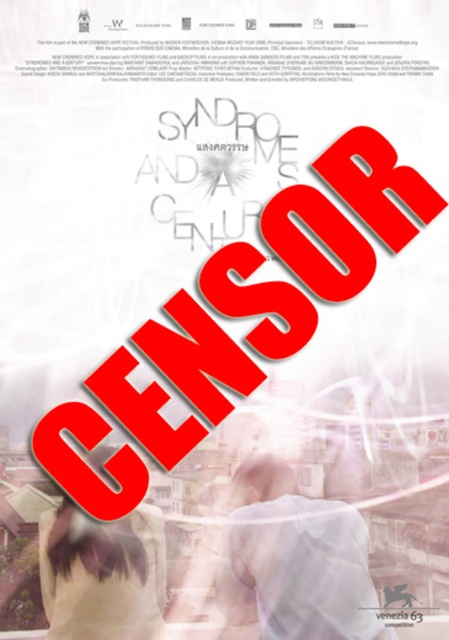
Question: Does white matte shirt at center have a lesser width compared to light beige fabric at lower left?

Choices:
 (A) no
 (B) yes

Answer: (A)

Question: Which point is farther to the camera?

Choices:
 (A) light beige fabric at lower left
 (B) white matte shirt at center

Answer: (B)

Question: Which point is farther from the camera taking this photo?

Choices:
 (A) (119, 538)
 (B) (237, 488)

Answer: (B)

Question: Which of the following is the closest to the observer?

Choices:
 (A) [x=330, y=630]
 (B) [x=110, y=548]

Answer: (A)

Question: Is white matte shirt at center wider than light beige fabric at lower left?

Choices:
 (A) yes
 (B) no

Answer: (A)

Question: Can you confirm if white matte shirt at center is thinner than light beige fabric at lower left?

Choices:
 (A) yes
 (B) no

Answer: (B)